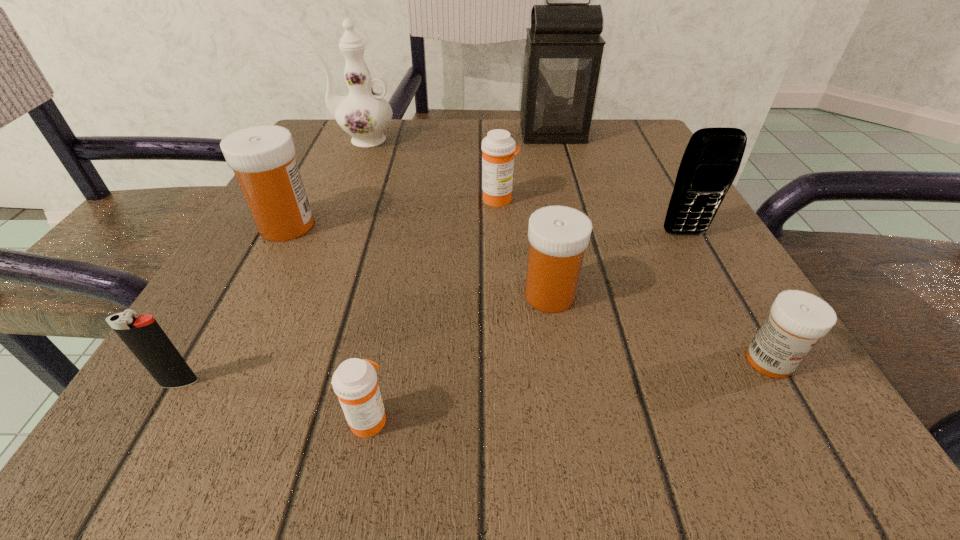
This screenshot has height=540, width=960. What are the coordinates of `free spot located 0.390m on the back of the black igniter` in the screenshot? It's located at [x=290, y=192].

This screenshot has height=540, width=960. What are the coordinates of `free space located on the left of the fourth farthest medicine` in the screenshot? It's located at (576, 361).

In order to click on vacant space situated on the back of the nearest medicine in this screenshot , I will do click(389, 317).

I want to click on lantern that is at the far edge, so click(561, 67).

I want to click on chinaware that is at the far edge, so click(364, 114).

Locate an element on the screen. Image resolution: width=960 pixels, height=540 pixels. igniter situated at the near edge is located at coordinates (145, 338).

Locate an element on the screen. This screenshot has height=540, width=960. chinaware situated at the left edge is located at coordinates (364, 114).

Locate an element on the screen. medicine at the left edge is located at coordinates (262, 157).

You are a GUI agent. You are given a task and a screenshot of the screen. Output one action in this format:
    pyautogui.click(x=<x>, y=<y>)
    Task: Click on the igniter present at the left edge
    Image resolution: width=960 pixels, height=540 pixels.
    Given the screenshot: What is the action you would take?
    pyautogui.click(x=145, y=338)

At what (x,y) coordinates should I click in order to perform the action: click on lantern that is at the right edge. Please return your answer as a coordinate pair (x, y). Looking at the image, I should click on (561, 67).